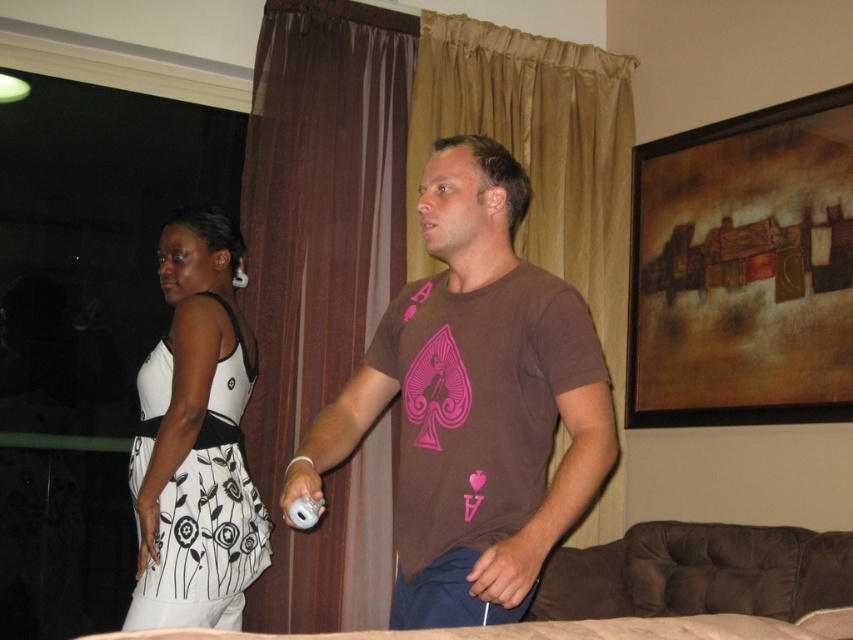
Question: Is brown sheer curtain at center bigger than white floral dress at left?

Choices:
 (A) no
 (B) yes

Answer: (B)

Question: Among these points, which one is nearest to the camera?

Choices:
 (A) (325, 148)
 (B) (523, 116)
 (C) (200, 452)
 (D) (305, 508)

Answer: (D)

Question: Among these points, which one is farthest from the camera?

Choices:
 (A) (318, 504)
 (B) (495, 120)
 (C) (283, 269)
 (D) (538, 316)

Answer: (B)

Question: Which object is closer to the camera taking this photo?

Choices:
 (A) white matte wii controller at center
 (B) brown sheer curtain at center
 (C) beige satin curtain at center

Answer: (A)

Question: Is brown matte t-shirt at center smaller than beige satin curtain at center?

Choices:
 (A) yes
 (B) no

Answer: (A)

Question: Where is beige satin curtain at center located in relation to white floral dress at left in the image?

Choices:
 (A) right
 (B) left

Answer: (A)